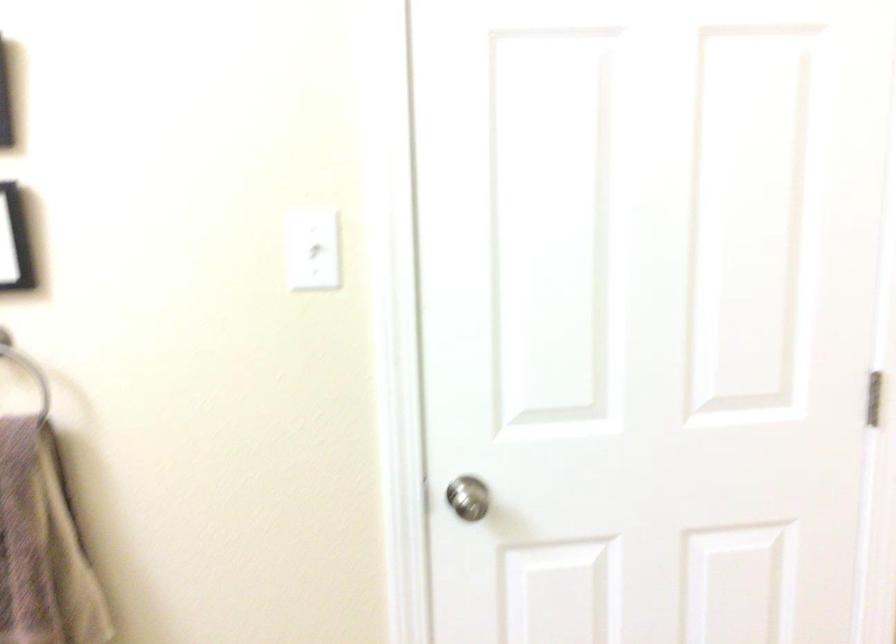
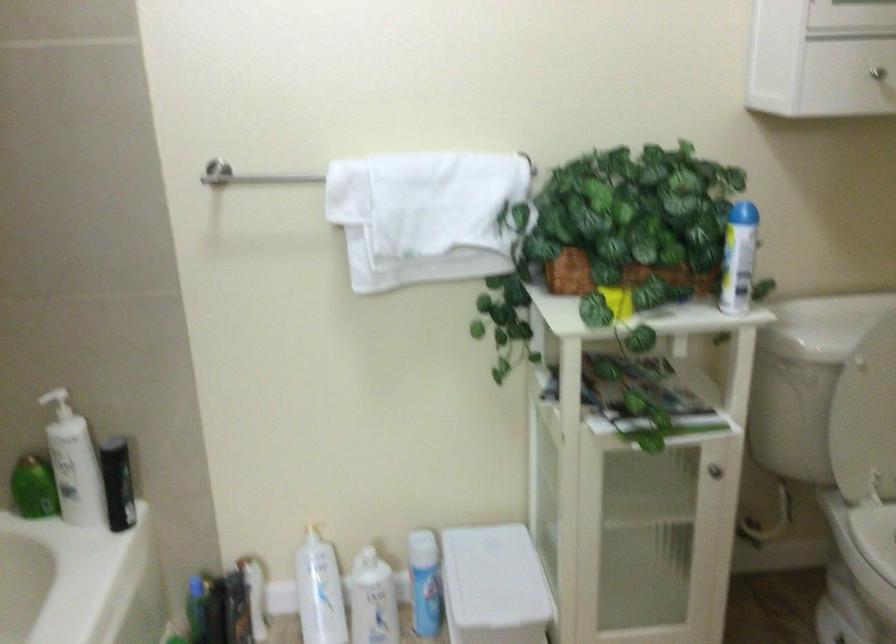
Question: How did the camera likely rotate?

Choices:
 (A) Left
 (B) Right
 (C) Up
 (D) Down

Answer: (B)